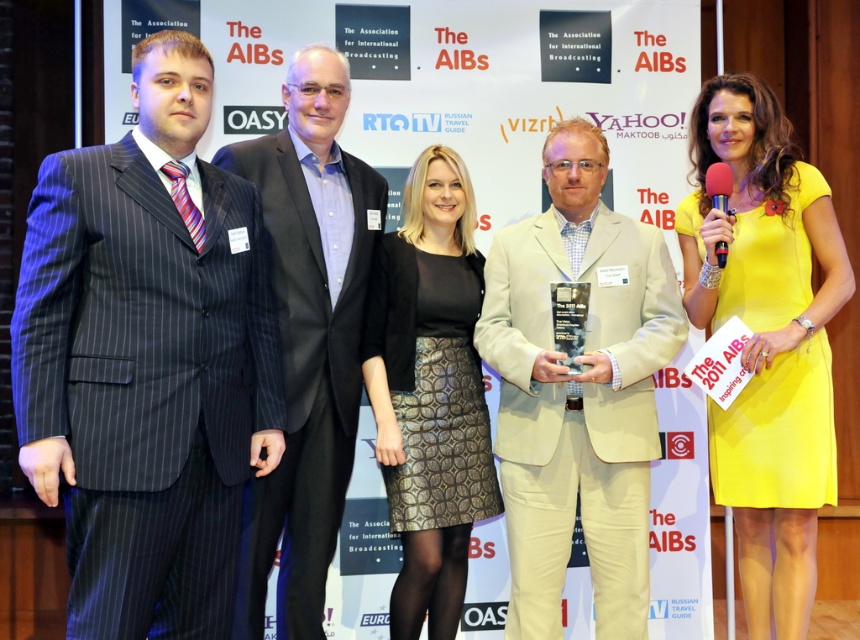
You are a photographer at the event and need to adjust the camera focus to capture both the matte pinstripe suit at left and the black textured skirt at center clearly. The camera can focus on objects within a 30 inch range. Will both subjects be in focus?

The matte pinstripe suit at left and black textured skirt at center are 31.81 inches apart, which exceeds the camera focus range of 30 inches. Therefore, both subjects cannot be in focus simultaneously.

Based on the scene description, which individual is shorter between the person wearing the matte pinstripe suit at left and the person in the beige fabric suit at center?

The person wearing the matte pinstripe suit at left is shorter than the person in the beige fabric suit at center.

Looking at this image, you are a photographer at the awards ceremony and need to adjust the lighting to ensure both the matte pinstripe suit at left and the black textured skirt at center are well lit. Given their sizes, which one might require a wider light spread to cover adequately?

The matte pinstripe suit at left is bigger than the black textured skirt at center, so it would require a wider light spread to ensure proper illumination.